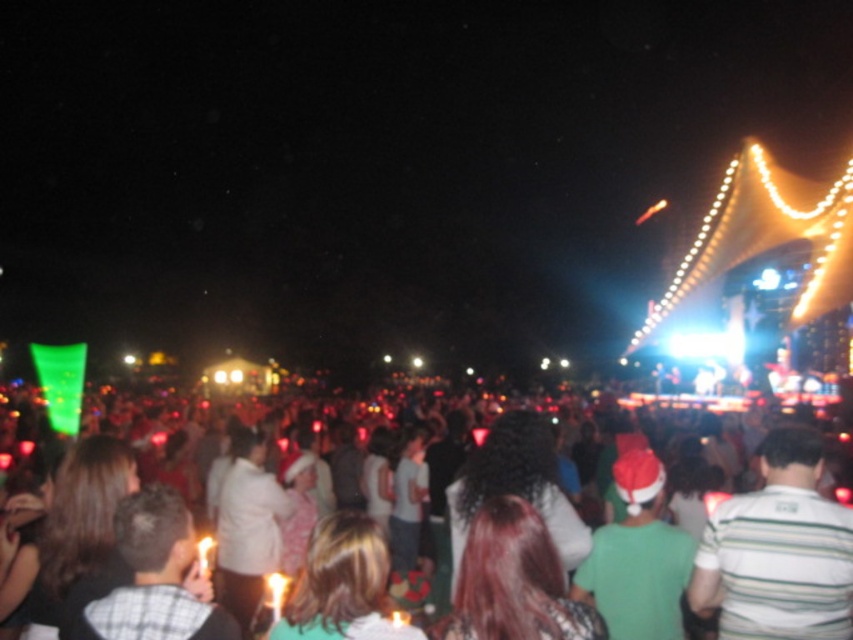
Can you confirm if white cotton shirt at center is smaller than striped cotton shirt at center?

No.

Does white cotton shirt at center have a greater height compared to striped cotton shirt at center?

Yes, white cotton shirt at center is taller than striped cotton shirt at center.

Which is in front, point (415, 605) or point (834, 566)?

Point (834, 566)

At what (x,y) coordinates should I click in order to perform the action: click on white cotton shirt at center. Please return your answer as a coordinate pair (x, y). Image resolution: width=853 pixels, height=640 pixels. Looking at the image, I should click on (323, 436).